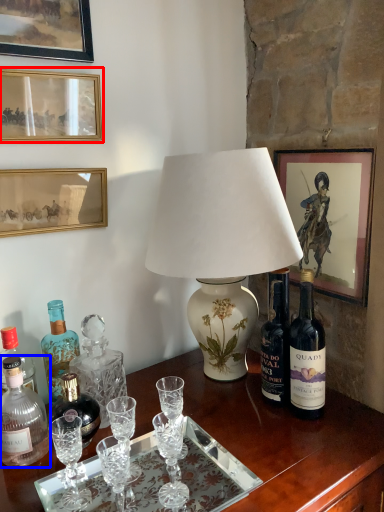
Question: Which of the following is the farthest to the observer, picture frame (highlighted by a red box) or bottle (highlighted by a blue box)?

Choices:
 (A) picture frame
 (B) bottle

Answer: (A)